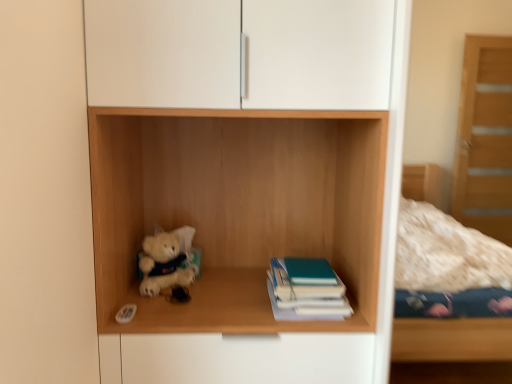
Where is `vacant space that is to the left of teal matte book at center`? vacant space that is to the left of teal matte book at center is located at coordinates (233, 300).